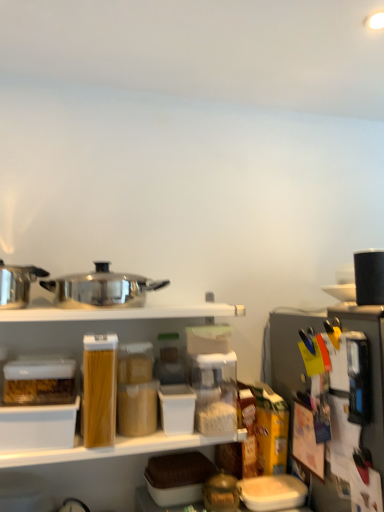
Question: In the image, is polished stainless steel pot at center, the third appliance in the right-to-left sequence, on the left side or the right side of polished stainless steel pot at left, marked as the 4th appliance in a right-to-left arrangement?

Choices:
 (A) right
 (B) left

Answer: (A)

Question: From a real-world perspective, relative to polished stainless steel pot at left, marked as the 4th appliance in a right-to-left arrangement, is polished stainless steel pot at center, positioned as the 2th appliance in left-to-right order, vertically above or below?

Choices:
 (A) above
 (B) below

Answer: (B)

Question: Which of these objects is positioned farthest from the metallic silver coffee maker at right, the second appliance positioned from the right?

Choices:
 (A) polished stainless steel pot at left, which ranks as the first appliance in left-to-right order
 (B) polished stainless steel pot at center, the third appliance in the right-to-left sequence
 (C) white plastic shelf at upper center
 (D) black matte coffee maker at upper right, positioned as the fourth appliance in left-to-right order
 (E) brown woven basket at center

Answer: (A)

Question: Considering the real-world distances, which object is farthest from the polished stainless steel pot at center, positioned as the 2th appliance in left-to-right order?

Choices:
 (A) polished stainless steel pot at left, marked as the 4th appliance in a right-to-left arrangement
 (B) white plastic shelf at upper center
 (C) black matte coffee maker at upper right, positioned as the fourth appliance in left-to-right order
 (D) brown woven basket at center
 (E) metallic silver coffee maker at right, which ranks as the 3th appliance in left-to-right order

Answer: (C)